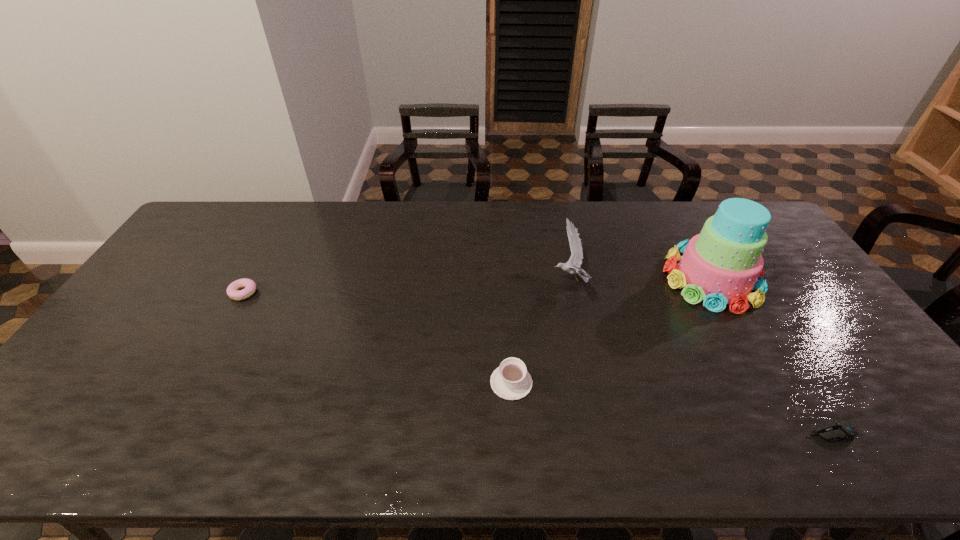
Where is `vacant space at the right edge of the desktop`? Image resolution: width=960 pixels, height=540 pixels. vacant space at the right edge of the desktop is located at coordinates (810, 314).

Find the location of a particular element. The height and width of the screenshot is (540, 960). vacant space at the far left corner of the desktop is located at coordinates (217, 221).

Where is `free spot between the nearest object and the cake`? free spot between the nearest object and the cake is located at coordinates (771, 356).

Identify the location of vacant area between the nearest object and the gull. coord(701,356).

Find the location of a particular element. Image resolution: width=960 pixels, height=540 pixels. empty location between the computer mouse and the doughnut is located at coordinates (538, 363).

The width and height of the screenshot is (960, 540). Find the location of `empty space that is in between the second tallest object and the doughnut`. empty space that is in between the second tallest object and the doughnut is located at coordinates (407, 287).

Find the location of `free spot between the second tallest object and the leftmost object`. free spot between the second tallest object and the leftmost object is located at coordinates click(x=407, y=287).

This screenshot has width=960, height=540. Identify the location of vacant point located between the second object from left to right and the leftmost object. (377, 338).

This screenshot has width=960, height=540. What are the coordinates of `free space between the gull and the computer mouse` in the screenshot? It's located at (701, 356).

Image resolution: width=960 pixels, height=540 pixels. Identify the location of free spot between the nearest object and the doughnut. (538, 363).